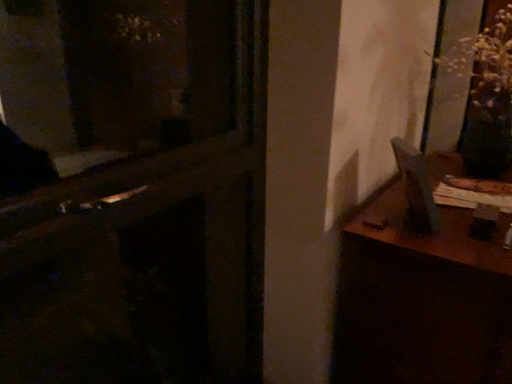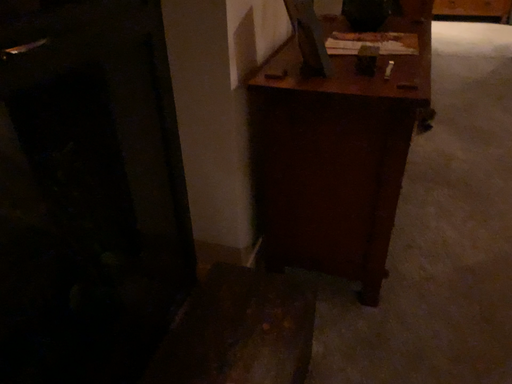
Question: How did the camera likely rotate when shooting the video?

Choices:
 (A) rotated downward
 (B) rotated upward

Answer: (A)